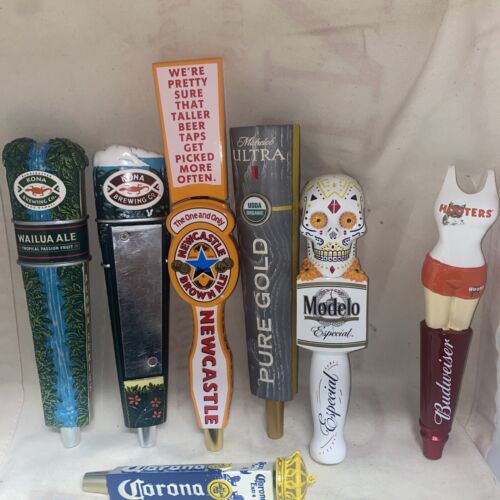
The height and width of the screenshot is (500, 500). What are the coordinates of `beer taps` in the screenshot? It's located at (59, 306), (144, 308), (207, 314), (271, 303), (333, 308), (447, 323), (202, 484).